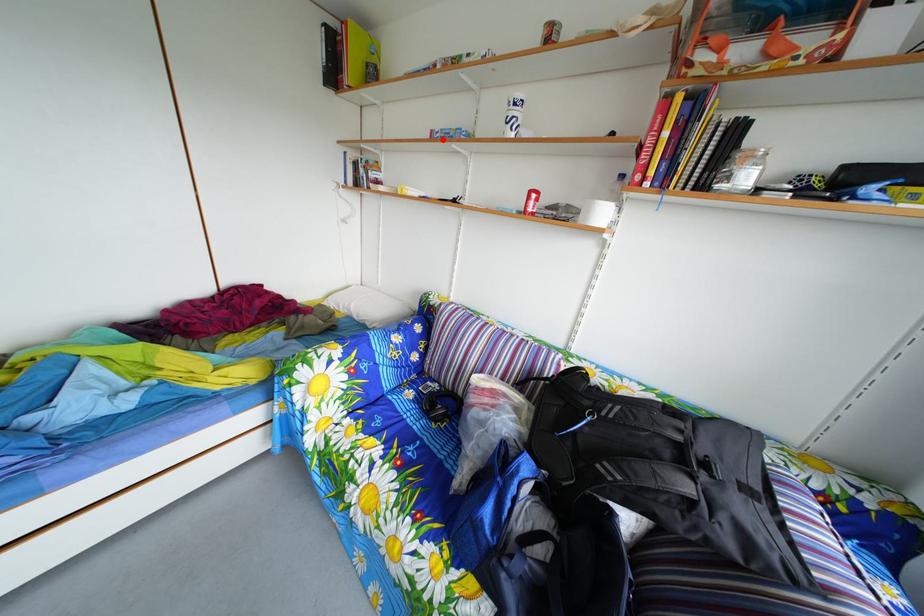
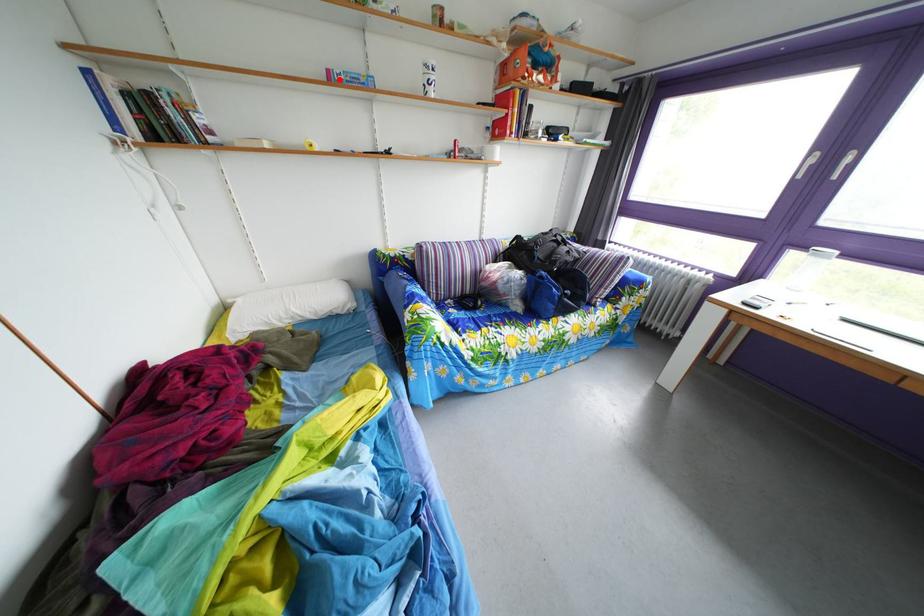
I am providing you with two images of the same scene from different viewpoints. A red point is marked on the first image and another point is marked on the second image. Do the highlighted points in image1 and image2 indicate the same real-world spot?

Yes